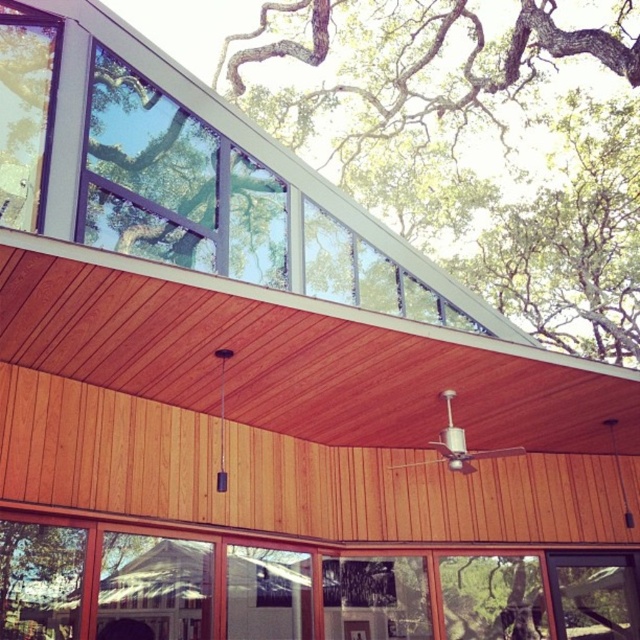
Can you confirm if green leafy tree at upper center is shorter than clear glass windows at upper center?

No.

Is green leafy tree at upper center to the left of clear glass windows at upper center from the viewer's perspective?

No, green leafy tree at upper center is not to the left of clear glass windows at upper center.

Is point (627, 282) positioned behind point (8, 40)?

Yes, it is.

The width and height of the screenshot is (640, 640). In order to click on green leafy tree at upper center in this screenshot , I will do `click(472, 136)`.

Which is more to the right, clear glass windows at upper center or clear glass window at center?

From the viewer's perspective, clear glass window at center appears more on the right side.

Who is higher up, clear glass windows at upper center or clear glass window at center?

clear glass windows at upper center is above.

Which is in front, point (33, 24) or point (572, 584)?

Point (33, 24)

This screenshot has width=640, height=640. I want to click on clear glass windows at upper center, so click(x=182, y=173).

Does green leafy tree at upper center come behind clear glass window at center?

That is True.

Between green leafy tree at upper center and clear glass window at center, which one is positioned lower?

clear glass window at center

Does point (397, 24) come behind point (625, 586)?

Yes, it is.

Where is `green leafy tree at upper center`? green leafy tree at upper center is located at coordinates pyautogui.click(x=472, y=136).